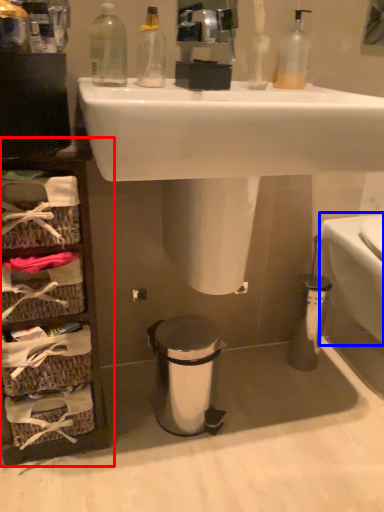
Question: Which point is closer to the camera, cabinet (highlighted by a red box) or toilet bowl (highlighted by a blue box)?

Choices:
 (A) cabinet
 (B) toilet bowl

Answer: (A)